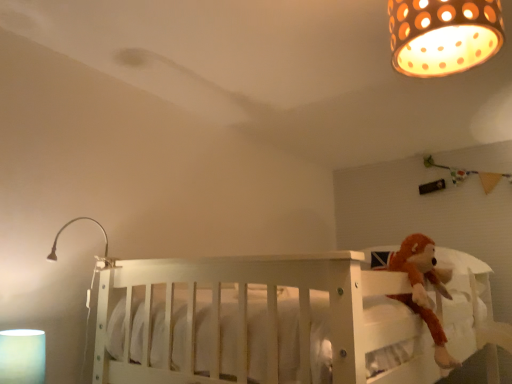
Question: From a real-world perspective, is white matte cylinder at lower left, the 2th lamp from the back, positioned over brown plush monkey at right based on gravity?

Choices:
 (A) yes
 (B) no

Answer: (B)

Question: Is brown plush monkey at right surrounded by white matte cylinder at lower left, which is the 3th lamp from top to bottom?

Choices:
 (A) yes
 (B) no

Answer: (B)

Question: Does white matte cylinder at lower left, the 2th lamp from the back, lie in front of brown plush monkey at right?

Choices:
 (A) no
 (B) yes

Answer: (B)

Question: From the image's perspective, does white matte cylinder at lower left, acting as the first lamp starting from the bottom, appear lower than brown plush monkey at right?

Choices:
 (A) yes
 (B) no

Answer: (A)

Question: From a real-world perspective, is white matte cylinder at lower left, the 2th lamp in the front-to-back sequence, located beneath brown plush monkey at right?

Choices:
 (A) no
 (B) yes

Answer: (B)

Question: From a real-world perspective, relative to brown plush monkey at right, is matte brown lampshade at upper right, acting as the first lamp starting from the front, vertically above or below?

Choices:
 (A) below
 (B) above

Answer: (B)

Question: Considering the positions of matte brown lampshade at upper right, marked as the first lamp in a right-to-left arrangement, and brown plush monkey at right in the image, is matte brown lampshade at upper right, marked as the first lamp in a right-to-left arrangement, wider or thinner than brown plush monkey at right?

Choices:
 (A) thin
 (B) wide

Answer: (B)

Question: From the image's perspective, is matte brown lampshade at upper right, which appears as the third lamp when viewed from the left, located above or below brown plush monkey at right?

Choices:
 (A) above
 (B) below

Answer: (A)

Question: Based on their positions, is matte brown lampshade at upper right, the third lamp in the bottom-to-top sequence, located to the left or right of brown plush monkey at right?

Choices:
 (A) right
 (B) left

Answer: (B)

Question: From a real-world perspective, is brown plush monkey at right physically located above or below metallic silver lamp at upper left, positioned as the 2th lamp in right-to-left order?

Choices:
 (A) below
 (B) above

Answer: (A)

Question: Is point (415, 271) positioned closer to the camera than point (53, 253)?

Choices:
 (A) farther
 (B) closer

Answer: (B)

Question: Based on their sizes in the image, would you say brown plush monkey at right is bigger or smaller than metallic silver lamp at upper left, arranged as the 2th lamp when viewed from the top?

Choices:
 (A) small
 (B) big

Answer: (B)

Question: From their relative heights in the image, would you say brown plush monkey at right is taller or shorter than metallic silver lamp at upper left, positioned as the 2th lamp in right-to-left order?

Choices:
 (A) tall
 (B) short

Answer: (A)

Question: From their relative heights in the image, would you say brown plush monkey at right is taller or shorter than matte brown lampshade at upper right, which appears as the third lamp when viewed from the left?

Choices:
 (A) short
 (B) tall

Answer: (B)

Question: Is brown plush monkey at right bigger or smaller than matte brown lampshade at upper right, the third lamp when ordered from back to front?

Choices:
 (A) big
 (B) small

Answer: (A)